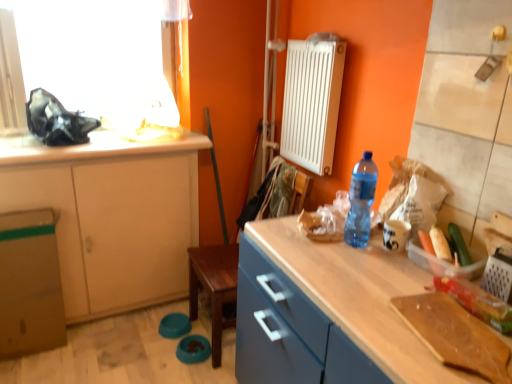
Question: Is point (134, 152) positioned closer to the camera than point (360, 240)?

Choices:
 (A) farther
 (B) closer

Answer: (A)

Question: Is white matte countertop at upper left wider or thinner than blue plastic bottle at right?

Choices:
 (A) wide
 (B) thin

Answer: (A)

Question: Estimate the real-world distances between objects in this image. Which object is closer to the matte wood cabinet at left?

Choices:
 (A) green plastic bag at right, marked as the 2th vegetable in a back-to-front arrangement
 (B) brown cardboard box at lower left
 (C) blue plastic bottle at right
 (D) green matte cucumber at right, the second vegetable when ordered from front to back
 (E) white matte countertop at upper left

Answer: (B)

Question: Which is nearer to the white metallic radiator at center right?

Choices:
 (A) wooden cutting board at lower right
 (B) white matte countertop at upper left
 (C) matte wood cabinet at left
 (D) blue plastic bottle at right
 (E) translucent plastic container at right

Answer: (D)